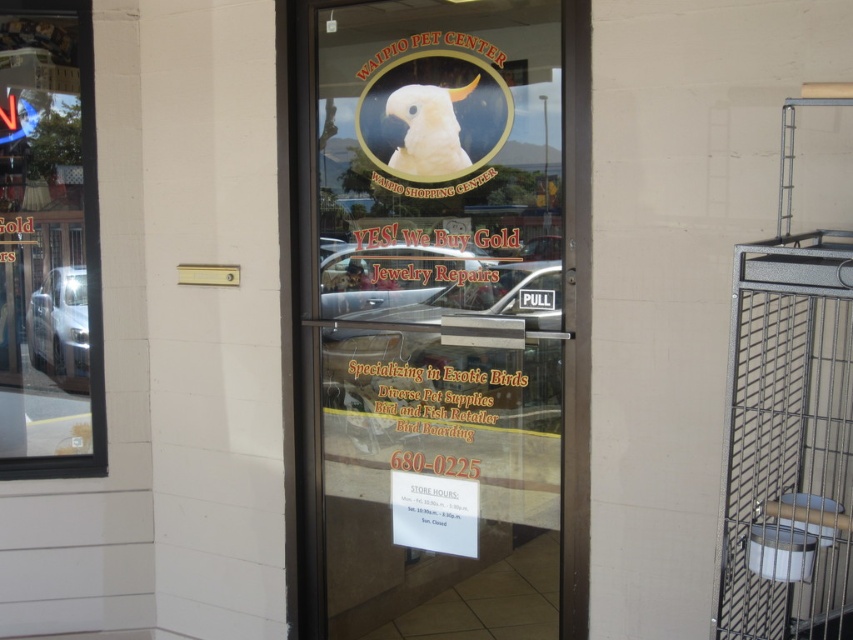
From the picture: You are standing at the entrance of the Waipio Shopping Center and want to locate the Waipio Pet Center. Based on the image, where should you look relative to the transparent glass door at center?

The transparent glass door at center is located at point (x=439, y=316), so you should look directly at the center of the entrance to find the Waipio Pet Center.

You are a delivery person with a 3.5 feet wide package. You need to deliver it to the Waipio Pet Center. The entrance has a transparent glass door at center and a transparent glass window at left. Can you fit the package through the space between them?

The transparent glass door at center and transparent glass window at left are 4.00 feet apart from each other. Since the package is 3.5 feet wide, it can fit through the space between them.

You are a customer entering the Waipio Shopping Center and want to locate the Waipio Pet Center entrance. You notice two transparent glass surfaces. Which one should you walk toward? The transparent glass door at center or the transparent glass window at left?

You should walk toward the transparent glass door at center because it is positioned under the transparent glass window at left, indicating it is the entrance.